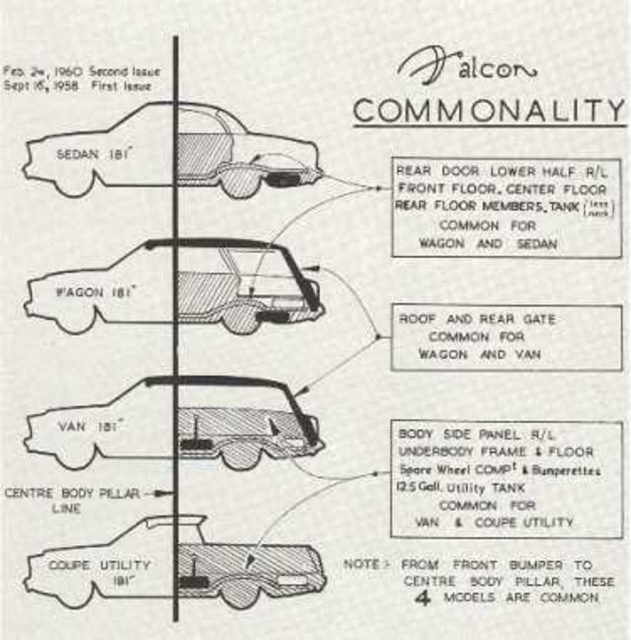
Question: Is matte black van at center to the right of matte black coupe utility at lower center from the viewer's perspective?

Choices:
 (A) no
 (B) yes

Answer: (A)

Question: Is matte black wagon at center to the right of matte black sedan at upper left from the viewer's perspective?

Choices:
 (A) yes
 (B) no

Answer: (B)

Question: Which object is positioned closest to the matte black wagon at center?

Choices:
 (A) matte black coupe utility at lower center
 (B) matte black sedan at upper left

Answer: (B)

Question: Observing the image, what is the correct spatial positioning of matte black wagon at center in reference to matte black van at center?

Choices:
 (A) above
 (B) below

Answer: (A)

Question: Which object is positioned closest to the matte black wagon at center?

Choices:
 (A) matte black van at center
 (B) matte black sedan at upper left
 (C) matte black coupe utility at lower center

Answer: (B)

Question: Estimate the real-world distances between objects in this image. Which object is closer to the matte black wagon at center?

Choices:
 (A) matte black van at center
 (B) matte black coupe utility at lower center

Answer: (A)